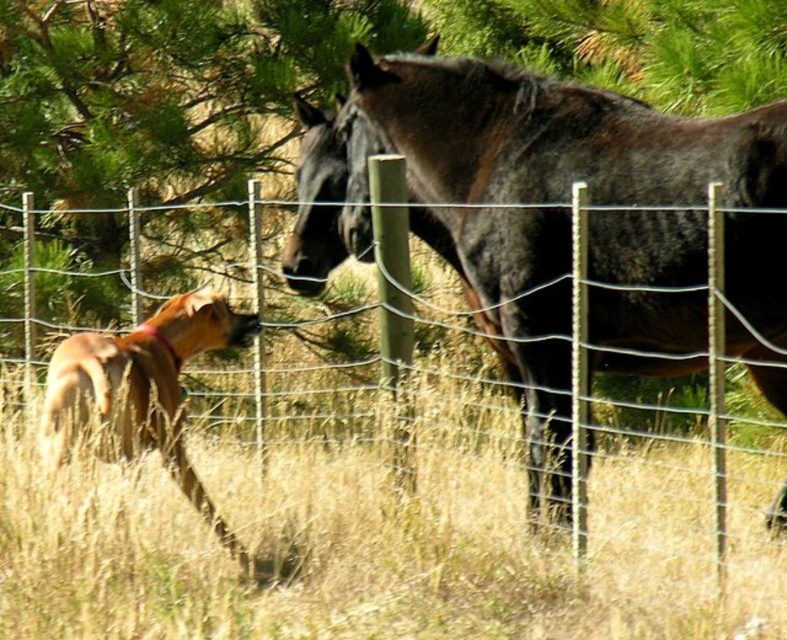
Question: Can you confirm if dry grass at lower left is wider than dark brown glossy horse at center?

Choices:
 (A) yes
 (B) no

Answer: (A)

Question: Among these points, which one is farthest from the camera?

Choices:
 (A) (135, 374)
 (B) (514, 344)
 (C) (781, 628)

Answer: (B)

Question: Does dark brown glossy horse at center appear over golden fur dog at lower left?

Choices:
 (A) no
 (B) yes

Answer: (B)

Question: Is dry grass at lower left in front of dark brown glossy horse at center?

Choices:
 (A) no
 (B) yes

Answer: (B)

Question: Which object is closer to the camera taking this photo?

Choices:
 (A) golden fur dog at lower left
 (B) dark brown glossy horse at center

Answer: (B)

Question: Which point appears farthest from the camera in this image?

Choices:
 (A) (589, 600)
 (B) (555, 314)

Answer: (B)